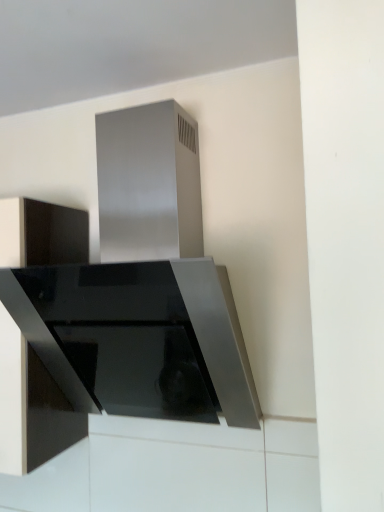
Measure the distance between glossy black range hood at center and camera.

34.91 inches.

This screenshot has width=384, height=512. Identify the location of glossy black range hood at center. (143, 276).

This screenshot has height=512, width=384. Describe the element at coordinates (143, 276) in the screenshot. I see `glossy black range hood at center` at that location.

Locate an element on the screen. The height and width of the screenshot is (512, 384). glossy black range hood at center is located at coordinates click(x=143, y=276).